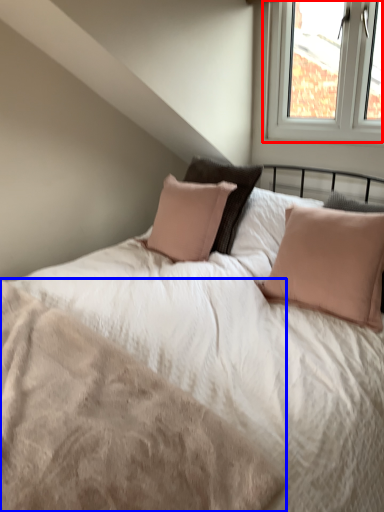
Question: Which object appears closest to the camera in this image, window (highlighted by a red box) or mattress (highlighted by a blue box)?

Choices:
 (A) window
 (B) mattress

Answer: (B)